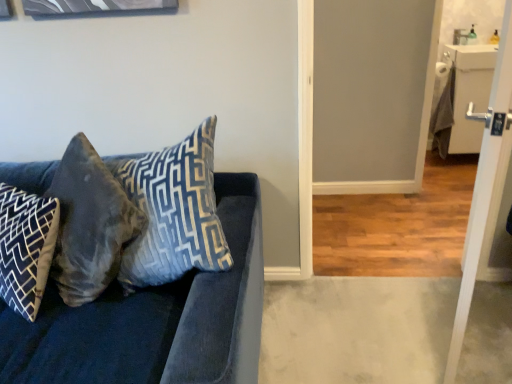
This screenshot has height=384, width=512. I want to click on vacant location below white glossy door at right (from a real-world perspective), so click(x=444, y=327).